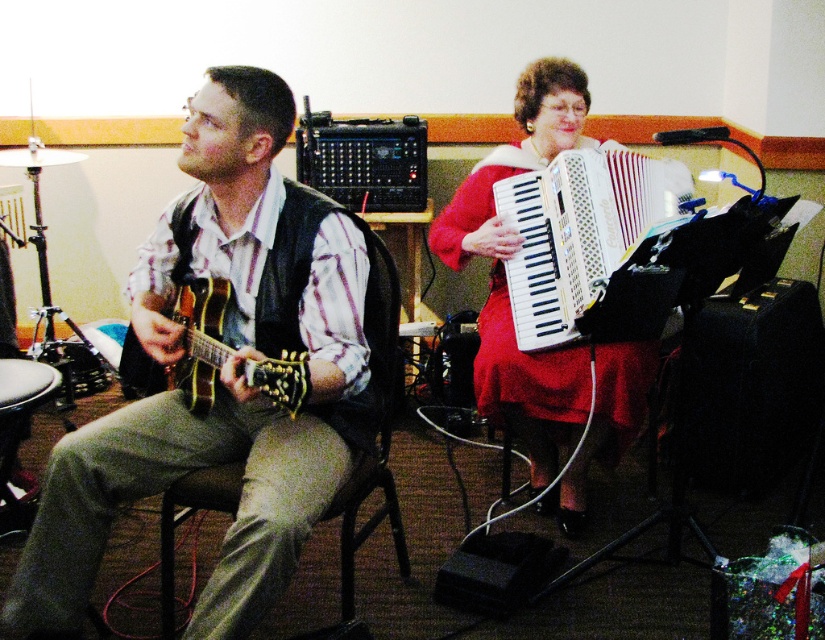
You are a photographer standing in front of the white plastic accordion at center. You want to take a closeup shot of the accordion. Can you move closer to it than 2 meters?

The white plastic accordion at center is 2.20 meters away from viewer. Since you want to take a closeup shot, you can move closer to it as it is currently 2.20 meters away, which is more than 2 meters. Moving to within 2 meters would allow for a closer shot.

You are a photographer setting up for a concert photo shoot. You need to position a spotlight at point (505, 280). What object should the spotlight illuminate?

The spotlight at point (505, 280) should illuminate the red satin dress at center.

You are standing in the middle of the room and want to place a new poster on the wall directly behind the matte black guitar at left. What coordinates should you aim for to ensure the poster is centered behind it?

The coordinates to center the poster behind the matte black guitar at left would be approximately the same x and y values as the guitar, so you should aim for point approximately 0.597 on the x and 0.273 on the y axis.